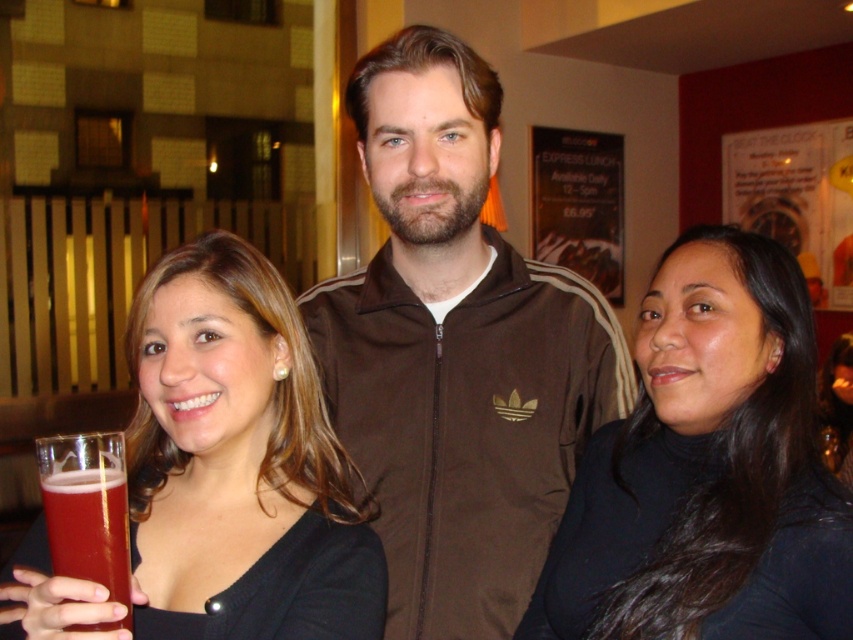
Question: Does translucent glass beer at lower left come in front of matte black hair at center?

Choices:
 (A) yes
 (B) no

Answer: (A)

Question: Is brown zip-up jacket at center above matte black hair at center?

Choices:
 (A) yes
 (B) no

Answer: (A)

Question: Which of the following is the closest to the observer?

Choices:
 (A) matte black hair at center
 (B) matte black dress at center

Answer: (B)

Question: Does matte black dress at center appear on the right side of translucent glass beer at lower left?

Choices:
 (A) yes
 (B) no

Answer: (A)

Question: Which point appears closest to the camera in this image?

Choices:
 (A) (418, 44)
 (B) (59, 445)
 (C) (827, 387)

Answer: (B)

Question: Considering the real-world distances, which object is closest to the translucent glass beer at lower left?

Choices:
 (A) matte black hair at center
 (B) matte black dress at center
 (C) black matte turtleneck at center

Answer: (B)